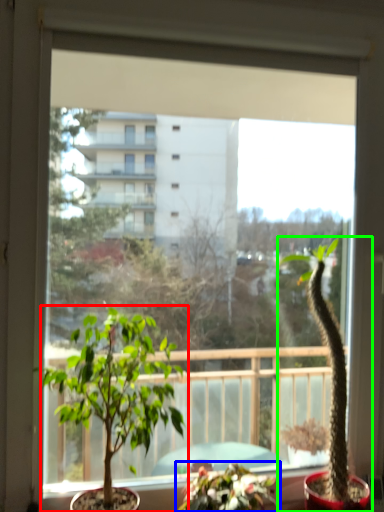
Question: Based on their relative distances, which object is nearer to houseplant (highlighted by a red box)? Choose from houseplant (highlighted by a blue box) and houseplant (highlighted by a green box).

Choices:
 (A) houseplant
 (B) houseplant

Answer: (A)